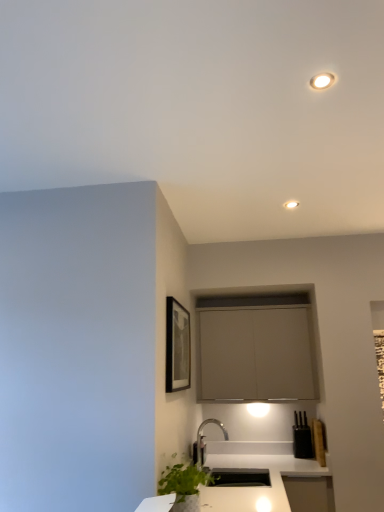
Question: Is matte white recessed light at upper center shorter than black matte picture frame at upper center?

Choices:
 (A) no
 (B) yes

Answer: (B)

Question: From a real-world perspective, is matte white recessed light at upper center located beneath black matte picture frame at upper center?

Choices:
 (A) yes
 (B) no

Answer: (B)

Question: Can you confirm if matte white recessed light at upper center is taller than black matte picture frame at upper center?

Choices:
 (A) yes
 (B) no

Answer: (B)

Question: Is matte white recessed light at upper center closer to the viewer compared to black matte picture frame at upper center?

Choices:
 (A) no
 (B) yes

Answer: (A)

Question: Considering the relative sizes of matte white recessed light at upper center and black matte picture frame at upper center in the image provided, is matte white recessed light at upper center wider than black matte picture frame at upper center?

Choices:
 (A) yes
 (B) no

Answer: (A)

Question: Is matte white recessed light at upper center to the right of black matte picture frame at upper center from the viewer's perspective?

Choices:
 (A) yes
 (B) no

Answer: (A)

Question: Is black matte picture frame at upper center wider than matte gray cabinet at center?

Choices:
 (A) yes
 (B) no

Answer: (B)

Question: Can you confirm if black matte picture frame at upper center is positioned to the left of matte gray cabinet at center?

Choices:
 (A) no
 (B) yes

Answer: (B)

Question: From the image's perspective, is black matte picture frame at upper center beneath matte gray cabinet at center?

Choices:
 (A) no
 (B) yes

Answer: (A)

Question: Would you say black matte picture frame at upper center is a long distance from matte gray cabinet at center?

Choices:
 (A) yes
 (B) no

Answer: (B)

Question: Is black matte picture frame at upper center further to camera compared to matte gray cabinet at center?

Choices:
 (A) no
 (B) yes

Answer: (A)

Question: Could you tell me if black matte picture frame at upper center is turned towards matte gray cabinet at center?

Choices:
 (A) yes
 (B) no

Answer: (B)

Question: From a real-world perspective, is matte white recessed light at upper center located higher than matte gray cabinet at center?

Choices:
 (A) yes
 (B) no

Answer: (A)